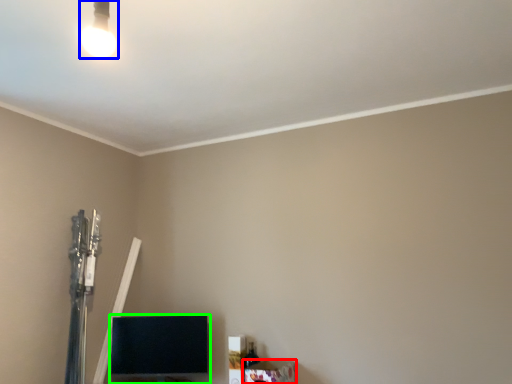
Question: Based on their relative distances, which object is nearer to furniture (highlighted by a red box)? Choose from lamp (highlighted by a blue box) and furniture (highlighted by a green box).

Choices:
 (A) lamp
 (B) furniture

Answer: (B)